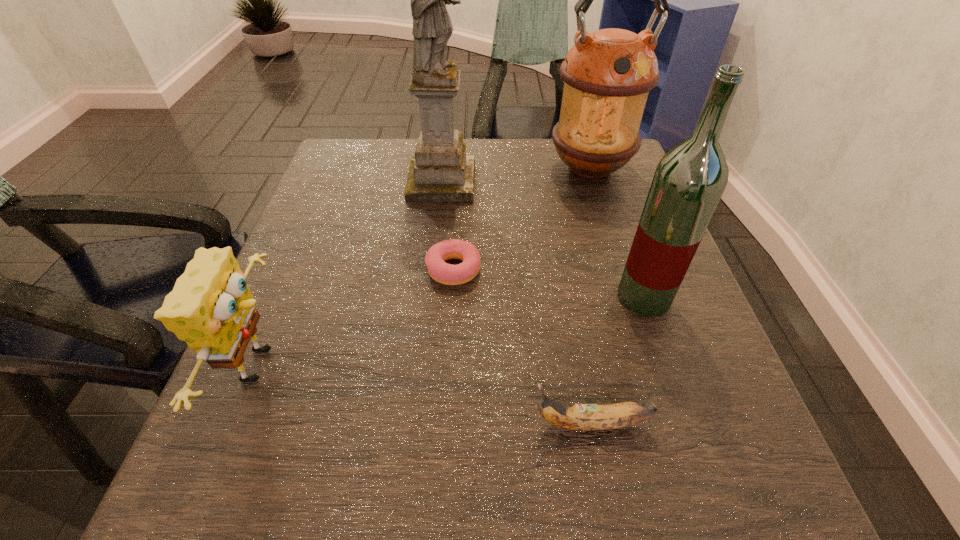
At what (x,y) coordinates should I click in order to perform the action: click on free space located on the face of the third shortest object. Please return your answer as a coordinate pair (x, y). Image resolution: width=960 pixels, height=540 pixels. Looking at the image, I should click on coord(432,364).

I want to click on free location located 0.110m on the peel of the fifth tallest object, so click(x=453, y=423).

I want to click on vacant space located 0.200m on the peel of the fifth tallest object, so click(389, 423).

Where is `free space located 0.380m on the peel of the fifth tallest object`? The image size is (960, 540). free space located 0.380m on the peel of the fifth tallest object is located at coordinates (259, 423).

The image size is (960, 540). Find the location of `vacant region located on the front of the doughnut`. vacant region located on the front of the doughnut is located at coordinates 442,460.

Locate an element on the screen. The image size is (960, 540). sculpture located at the far edge is located at coordinates (440, 171).

Locate an element on the screen. oil lamp located in the far edge section of the desktop is located at coordinates (607, 74).

Identify the location of object located at the left edge. (210, 307).

Locate an element on the screen. Image resolution: width=960 pixels, height=540 pixels. oil lamp that is at the right edge is located at coordinates (607, 74).

At what (x,y) coordinates should I click in order to perform the action: click on liquor present at the right edge. Please return your answer as a coordinate pair (x, y). Looking at the image, I should click on (689, 180).